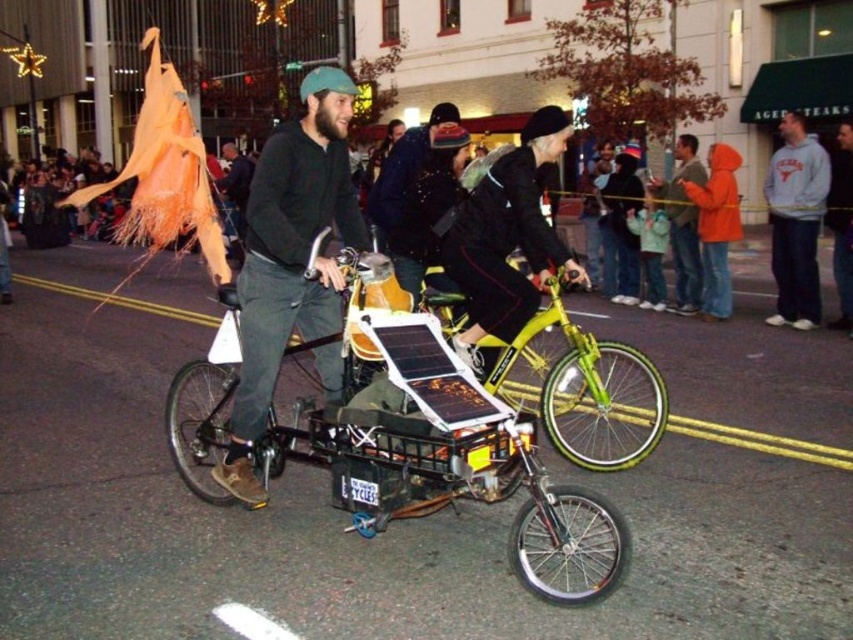
Question: Estimate the real-world distances between objects in this image. Which object is closer to the gray fleece sweatshirt at upper right?

Choices:
 (A) orange fabric at right
 (B) orange hooded jacket at right
 (C) dark gray fleece jacket at center
 (D) metallic yellow bicycle at center

Answer: (B)

Question: Considering the relative positions of yellow metallic tricycle at center and metallic yellow bicycle at center in the image provided, where is yellow metallic tricycle at center located with respect to metallic yellow bicycle at center?

Choices:
 (A) above
 (B) below

Answer: (B)

Question: Does black matte jacket at center have a lesser width compared to gray fleece sweatshirt at upper right?

Choices:
 (A) yes
 (B) no

Answer: (B)

Question: Does dark gray fleece jacket at center have a greater width compared to black matte jacket at center?

Choices:
 (A) yes
 (B) no

Answer: (B)

Question: Based on their relative distances, which object is nearer to the black matte jacket at center?

Choices:
 (A) orange hooded jacket at right
 (B) orange fabric at right
 (C) gray fleece sweatshirt at upper right

Answer: (A)

Question: Which point appears farthest from the camera in this image?

Choices:
 (A) (196, 488)
 (B) (701, 230)
 (C) (664, 195)
 (D) (454, 269)

Answer: (C)